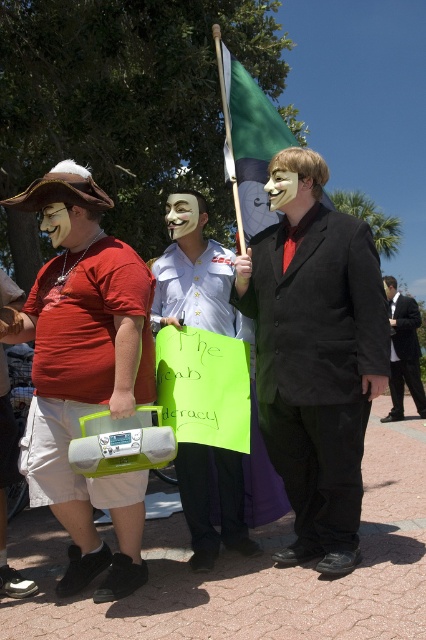
You are a fashion designer observing the two items worn by the middle person in the image. Which item is bigger in size between the matte black suit at center and the white matte mask at center?

The matte black suit at center is larger in size compared to the white matte mask at center.

You are a fashion designer analyzing the outfit of the person in the middle. The person is wearing a matte black suit at center and a white matte mask at center. Which item has a greater width?

The matte black suit at center has a greater width than the white matte mask at center.

You are a fashion designer analyzing the outfit of the person in the middle. The person is wearing a black suit at center and a matte black mask at center. Which item of clothing is larger?

The black suit at center is bigger than the matte black mask at center.